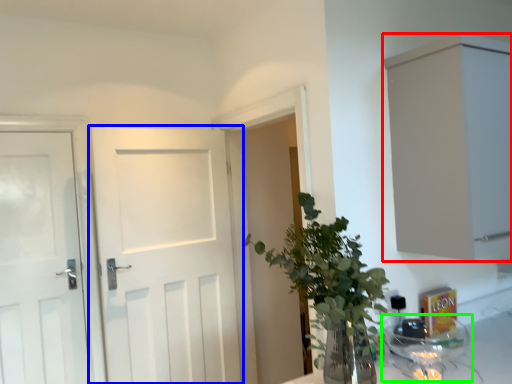
Question: Considering the real-world distances, which object is farthest from cabinetry (highlighted by a red box)? door (highlighted by a blue box) or glass jar (highlighted by a green box)?

Choices:
 (A) door
 (B) glass jar

Answer: (A)